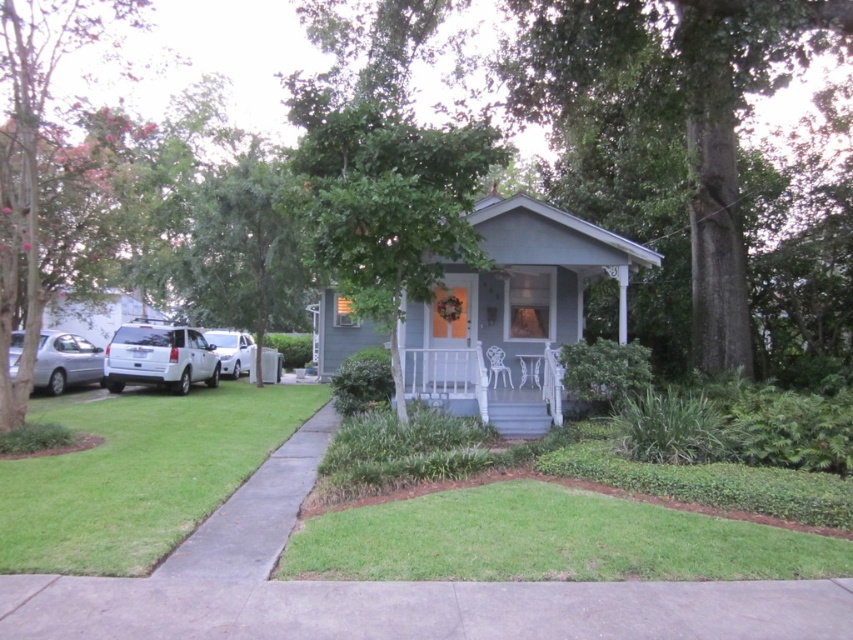
You are standing at the front door of the house and want to park your car, which is the white matte suv at left, in the driveway. Based on its current position, is it possible to drive the car directly into the driveway without moving any obstacles?

The white matte suv at left is positioned at point (x=160, y=356), so it is already in the driveway and ready to be parked without needing to move any obstacles.

You are a delivery person arriving at this house. You need to park your vehicle, the white matte suv at left, near the white painted wood porch at center. Given that the porch is larger than the SUV, can you safely park the SUV on the porch without overlapping it?

The white painted wood porch at center is bigger than the white matte suv at left, so yes, the SUV can be parked on the porch without overlapping since the porch has enough space to accommodate the SUV.